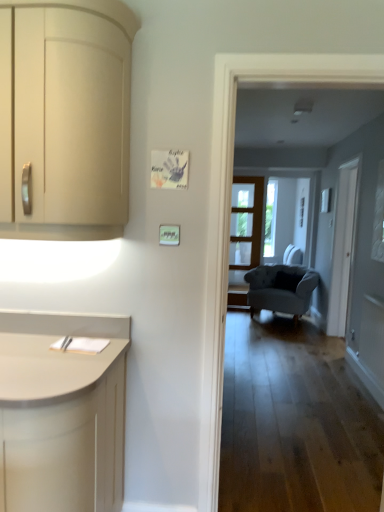
Question: Is velvet grey armchair at center positioned behind clear glass door at center?

Choices:
 (A) no
 (B) yes

Answer: (A)

Question: Does velvet grey armchair at center have a larger size compared to clear glass door at center?

Choices:
 (A) no
 (B) yes

Answer: (B)

Question: From a real-world perspective, is velvet grey armchair at center positioned under clear glass door at center based on gravity?

Choices:
 (A) no
 (B) yes

Answer: (B)

Question: Would you consider velvet grey armchair at center to be distant from clear glass door at center?

Choices:
 (A) no
 (B) yes

Answer: (A)

Question: Is velvet grey armchair at center taller than clear glass door at center?

Choices:
 (A) yes
 (B) no

Answer: (B)

Question: Would you say matte cream cabinet at left is to the left or to the right of velvet grey armchair at center in the picture?

Choices:
 (A) left
 (B) right

Answer: (A)

Question: From a real-world perspective, is matte cream cabinet at left physically located above or below velvet grey armchair at center?

Choices:
 (A) above
 (B) below

Answer: (A)

Question: From the image's perspective, is matte cream cabinet at left positioned above or below velvet grey armchair at center?

Choices:
 (A) below
 (B) above

Answer: (B)

Question: Is point (82, 179) positioned closer to the camera than point (284, 285)?

Choices:
 (A) closer
 (B) farther

Answer: (A)

Question: Does point [x=107, y=181] appear closer or farther from the camera than point [x=236, y=224]?

Choices:
 (A) farther
 (B) closer

Answer: (B)

Question: From a real-world perspective, is matte cream cabinet at left above or below clear glass door at center?

Choices:
 (A) below
 (B) above

Answer: (B)

Question: Looking at their shapes, would you say matte cream cabinet at left is wider or thinner than clear glass door at center?

Choices:
 (A) thin
 (B) wide

Answer: (B)

Question: Is matte cream cabinet at left taller or shorter than clear glass door at center?

Choices:
 (A) tall
 (B) short

Answer: (B)

Question: Is point (334, 317) positioned closer to the camera than point (16, 236)?

Choices:
 (A) closer
 (B) farther

Answer: (B)

Question: Choose the correct answer: Is white glass screen door at right inside matte cream cabinet at left or outside it?

Choices:
 (A) inside
 (B) outside

Answer: (B)